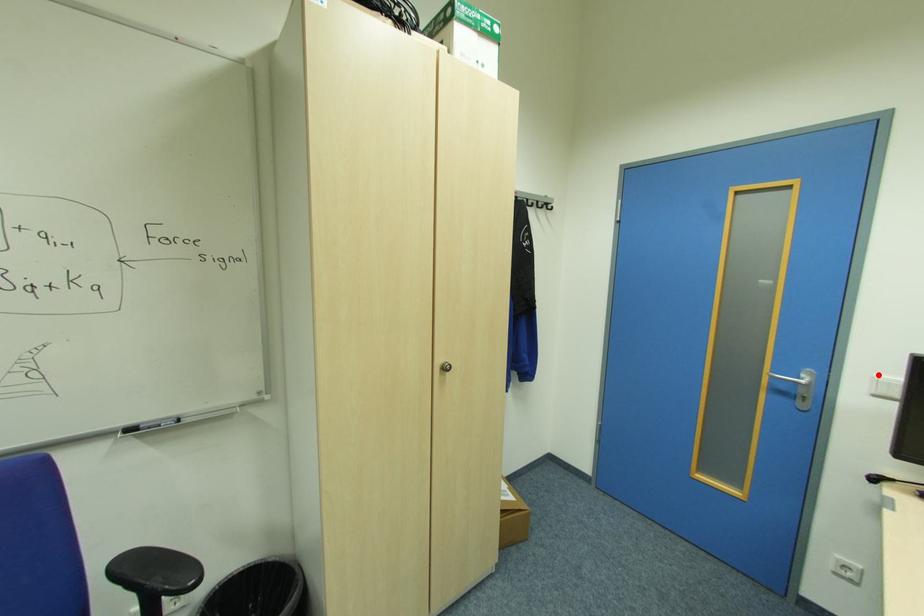
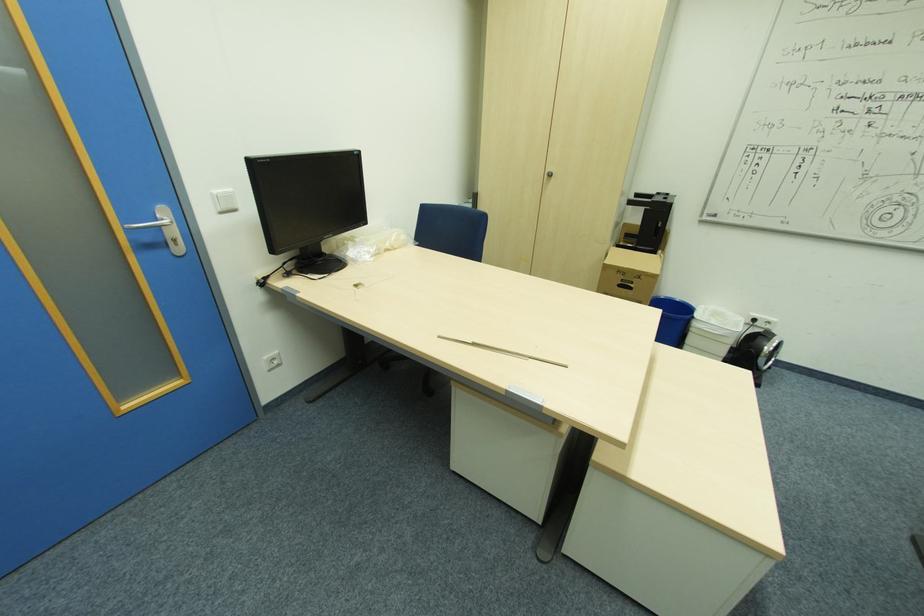
Where in the second image is the point corresponding to the highlighted location from the first image?

(216, 191)